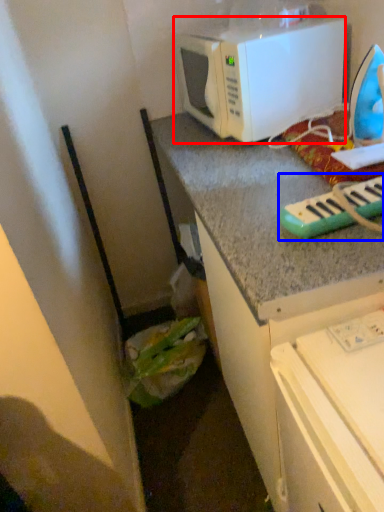
Question: Which object appears farthest to the camera in this image, microwave oven (highlighted by a red box) or musical keyboard (highlighted by a blue box)?

Choices:
 (A) microwave oven
 (B) musical keyboard

Answer: (A)